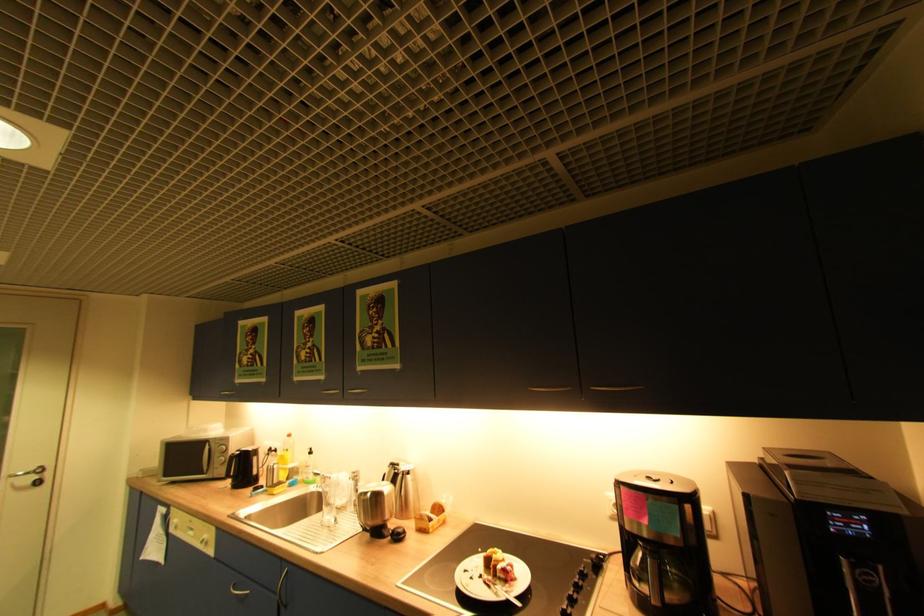
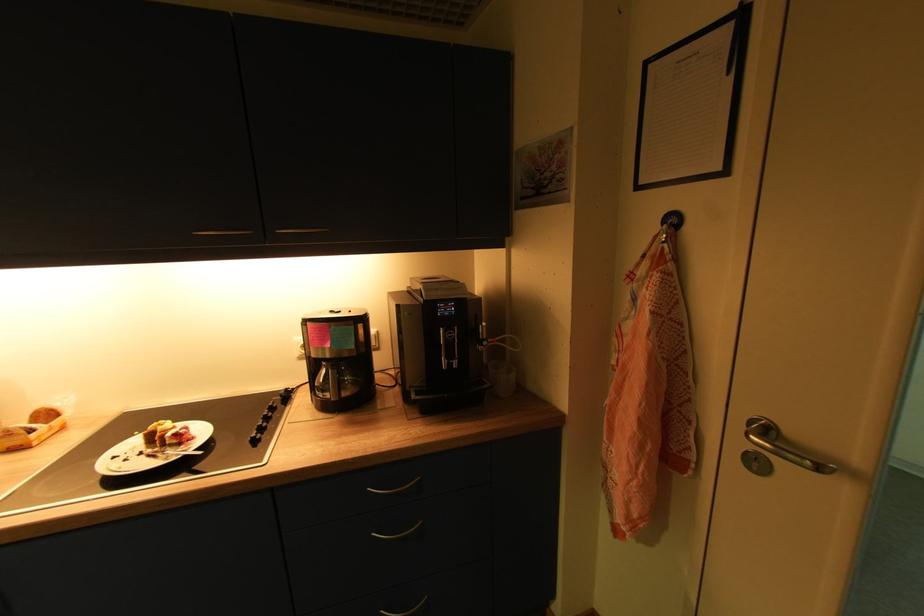
The first image is from the beginning of the video and the second image is from the end. How did the camera likely rotate when shooting the video?

The camera rotated toward right-down.